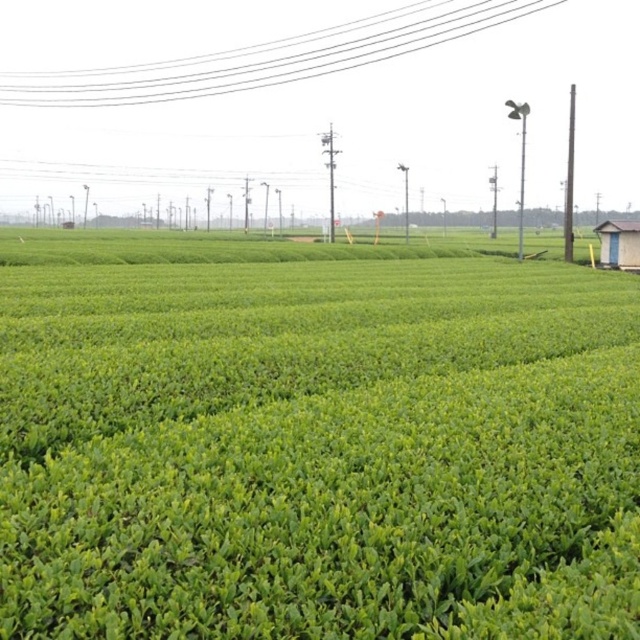
You are a farmer inspecting the tea plantations and notice the green leafy field at center and the white wire at upper center. Which object is positioned higher in the image?

The white wire at upper center is positioned higher than the green leafy field at center in the image.